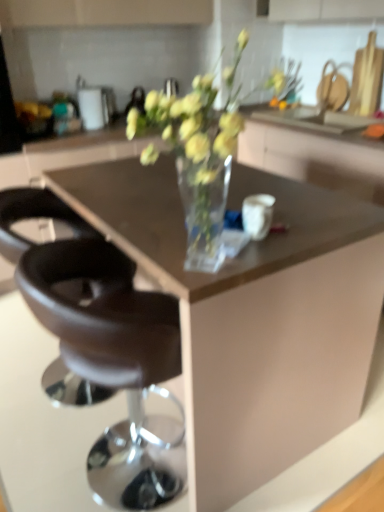
Describe the element at coordinates (316, 158) in the screenshot. This screenshot has width=384, height=512. I see `transparent glass cabinet at center` at that location.

What do you see at coordinates (35, 218) in the screenshot?
I see `black leather stool at lower left, positioned as the second chair in front-to-back order` at bounding box center [35, 218].

The image size is (384, 512). I want to click on black leather stool at lower left, which appears as the first chair when viewed from the back, so click(35, 218).

In order to click on brown leather stool at center, the second chair in the back-to-front sequence in this screenshot , I will do tap(113, 357).

Is black leather stool at lower left, positioned as the second chair in front-to-back order, further to camera compared to brown leather stool at center, the second chair in the back-to-front sequence?

Yes, black leather stool at lower left, positioned as the second chair in front-to-back order, is further from the viewer.

Is point (86, 388) positioned in front of point (107, 245)?

That is False.

Is black leather stool at lower left, positioned as the second chair in front-to-back order, to the left or to the right of brown leather stool at center, the first chair positioned from the front, in the image?

black leather stool at lower left, positioned as the second chair in front-to-back order, is to the left of brown leather stool at center, the first chair positioned from the front.

Considering the sizes of objects black leather stool at lower left, positioned as the second chair in front-to-back order, and brown leather stool at center, the first chair positioned from the front, in the image provided, who is shorter, black leather stool at lower left, positioned as the second chair in front-to-back order, or brown leather stool at center, the first chair positioned from the front,?

black leather stool at lower left, positioned as the second chair in front-to-back order.

From a real-world perspective, relative to brown leather stool at center, the first chair positioned from the front, is transparent glass cabinet at center vertically above or below?

From a real-world perspective, transparent glass cabinet at center is physically above brown leather stool at center, the first chair positioned from the front.

Is transparent glass cabinet at center next to brown leather stool at center, the second chair in the back-to-front sequence?

They are not placed beside each other.

From the image's perspective, which one is positioned higher, transparent glass cabinet at center or brown leather stool at center, the first chair positioned from the front?

transparent glass cabinet at center.

Can you tell me how much transparent glass cabinet at center and brown leather stool at center, the first chair positioned from the front, differ in facing direction?

180 degrees.

From the image's perspective, which one is positioned higher, transparent glass cabinet at center or black leather stool at lower left, positioned as the second chair in front-to-back order?

transparent glass cabinet at center, from the image's perspective.

Is point (276, 145) less distant than point (78, 225)?

No, it is behind (78, 225).

Is transparent glass cabinet at center taller or shorter than black leather stool at lower left, positioned as the second chair in front-to-back order?

transparent glass cabinet at center is shorter than black leather stool at lower left, positioned as the second chair in front-to-back order.

How different are the orientations of transparent glass cabinet at center and black leather stool at lower left, positioned as the second chair in front-to-back order, in degrees?

The angular difference between transparent glass cabinet at center and black leather stool at lower left, positioned as the second chair in front-to-back order, is 180 degrees.

Considering the relative positions of black leather stool at lower left, positioned as the second chair in front-to-back order, and transparent glass cabinet at center in the image provided, is black leather stool at lower left, positioned as the second chair in front-to-back order, to the left of transparent glass cabinet at center from the viewer's perspective?

Yes.

I want to click on cabinetry that is above the black leather stool at lower left, which appears as the first chair when viewed from the back (from the image's perspective), so click(316, 158).

Is black leather stool at lower left, which appears as the first chair when viewed from the back, looking in the opposite direction of transparent glass cabinet at center?

That's not correct — black leather stool at lower left, which appears as the first chair when viewed from the back, is not looking away from transparent glass cabinet at center.

Choose the correct answer: Is brown leather stool at center, the first chair positioned from the front, inside transparent glass cabinet at center or outside it?

brown leather stool at center, the first chair positioned from the front, exists outside the volume of transparent glass cabinet at center.

Is brown leather stool at center, the second chair in the back-to-front sequence, facing towards transparent glass cabinet at center?

No, brown leather stool at center, the second chair in the back-to-front sequence, does not turn towards transparent glass cabinet at center.

Considering the sizes of objects brown leather stool at center, the second chair in the back-to-front sequence, and transparent glass cabinet at center in the image provided, who is taller, brown leather stool at center, the second chair in the back-to-front sequence, or transparent glass cabinet at center?

brown leather stool at center, the second chair in the back-to-front sequence.

In the image, is brown leather stool at center, the second chair in the back-to-front sequence, positioned in front of or behind black leather stool at lower left, which appears as the first chair when viewed from the back?

In the image, brown leather stool at center, the second chair in the back-to-front sequence, appears in front of black leather stool at lower left, which appears as the first chair when viewed from the back.

Is brown leather stool at center, the second chair in the back-to-front sequence, oriented towards black leather stool at lower left, positioned as the second chair in front-to-back order?

No, brown leather stool at center, the second chair in the back-to-front sequence, is not aimed at black leather stool at lower left, positioned as the second chair in front-to-back order.

Considering the sizes of objects brown leather stool at center, the first chair positioned from the front, and black leather stool at lower left, which appears as the first chair when viewed from the back, in the image provided, who is smaller, brown leather stool at center, the first chair positioned from the front, or black leather stool at lower left, which appears as the first chair when viewed from the back,?

brown leather stool at center, the first chair positioned from the front.

Is point (174, 321) behind point (45, 379)?

That is False.

The height and width of the screenshot is (512, 384). I want to click on chair on the right of black leather stool at lower left, positioned as the second chair in front-to-back order, so click(113, 357).

Where is `the 1st chair below the transparent glass cabinet at center (from a real-world perspective)`? This screenshot has height=512, width=384. the 1st chair below the transparent glass cabinet at center (from a real-world perspective) is located at coordinates (113, 357).

From the image, which object appears to be nearer to transparent glass cabinet at center, brown leather stool at center, the first chair positioned from the front, or black leather stool at lower left, which appears as the first chair when viewed from the back?

Among the two, black leather stool at lower left, which appears as the first chair when viewed from the back, is located nearer to transparent glass cabinet at center.

Which object lies nearer to the anchor point black leather stool at lower left, which appears as the first chair when viewed from the back, brown leather stool at center, the second chair in the back-to-front sequence, or transparent glass cabinet at center?

Based on the image, brown leather stool at center, the second chair in the back-to-front sequence, appears to be nearer to black leather stool at lower left, which appears as the first chair when viewed from the back.

In the scene shown: Estimate the real-world distances between objects in this image. Which object is closer to black leather stool at lower left, which appears as the first chair when viewed from the back, transparent glass cabinet at center or brown leather stool at center, the first chair positioned from the front?

brown leather stool at center, the first chair positioned from the front, is positioned closer to the anchor black leather stool at lower left, which appears as the first chair when viewed from the back.

From the image, which object appears to be farther from brown leather stool at center, the second chair in the back-to-front sequence, black leather stool at lower left, positioned as the second chair in front-to-back order, or transparent glass cabinet at center?

transparent glass cabinet at center is positioned further to the anchor brown leather stool at center, the second chair in the back-to-front sequence.

Which object lies further to the anchor point transparent glass cabinet at center, black leather stool at lower left, positioned as the second chair in front-to-back order, or brown leather stool at center, the second chair in the back-to-front sequence?

Among the two, brown leather stool at center, the second chair in the back-to-front sequence, is located further to transparent glass cabinet at center.

When comparing their distances from brown leather stool at center, the second chair in the back-to-front sequence, does transparent glass cabinet at center or black leather stool at lower left, positioned as the second chair in front-to-back order, seem further?

transparent glass cabinet at center is positioned further to the anchor brown leather stool at center, the second chair in the back-to-front sequence.

Locate an element on the screen. chair located between black leather stool at lower left, which appears as the first chair when viewed from the back, and transparent glass cabinet at center in the left-right direction is located at coordinates (113, 357).